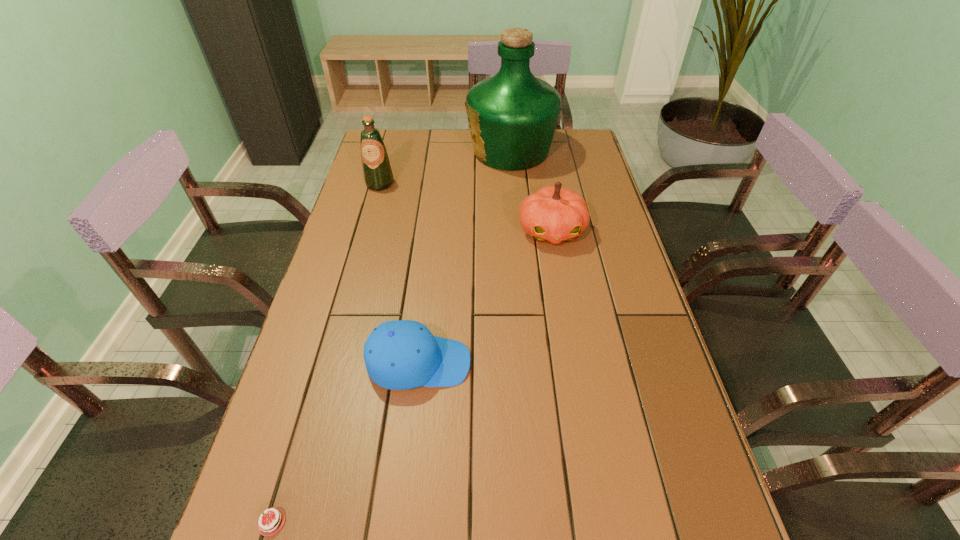
Locate an element on the screen. The image size is (960, 540). vacant space that satisfies the following two spatial constraints: 1. on the label side of the liquor; 2. on the front-facing side of the olive oil is located at coordinates (514, 184).